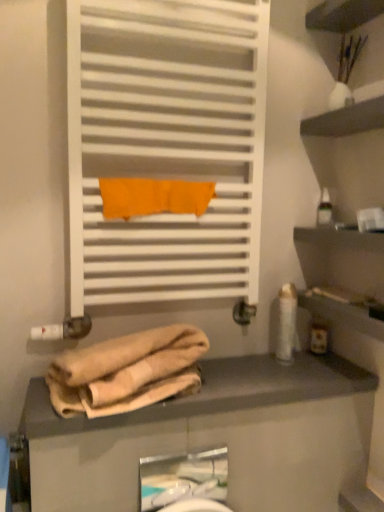
Question: From a real-world perspective, is white glossy lotion at right, the 1th toiletry in the left-to-right sequence, positioned above or below white matte towel rack at upper center?

Choices:
 (A) below
 (B) above

Answer: (A)

Question: From the image's perspective, is white glossy lotion at right, marked as the third toiletry in a right-to-left arrangement, above or below white matte towel rack at upper center?

Choices:
 (A) below
 (B) above

Answer: (A)

Question: Estimate the real-world distances between objects in this image. Which object is farther from the transparent plastic bottle at upper right, the third toiletry viewed from the left?

Choices:
 (A) white matte towel rack at upper center
 (B) beige fabric at lower center
 (C) beige cotton towel at lower center
 (D) white glossy lotion at right, marked as the third toiletry in a right-to-left arrangement
 (E) white glossy sink at lower center

Answer: (E)

Question: Which object is positioned farthest from the translucent plastic bottle at right, positioned as the 1th toiletry in bottom-to-top order?

Choices:
 (A) transparent plastic bottle at upper right, the third toiletry viewed from the left
 (B) orange fabric towel at center
 (C) beige cotton towel at lower center
 (D) white glossy sink at lower center
 (E) white glossy lotion at right, marked as the third toiletry in a right-to-left arrangement

Answer: (D)